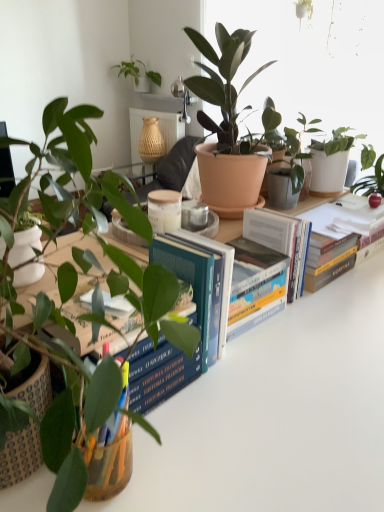
Question: Are white glossy table at center and blue hardcover book at center located far from each other?

Choices:
 (A) no
 (B) yes

Answer: (A)

Question: Is white glossy table at center behind blue hardcover book at center?

Choices:
 (A) no
 (B) yes

Answer: (A)

Question: Is the depth of white glossy table at center less than that of blue hardcover book at center?

Choices:
 (A) no
 (B) yes

Answer: (B)

Question: Could you tell me if white glossy table at center is facing blue hardcover book at center?

Choices:
 (A) no
 (B) yes

Answer: (A)

Question: Considering the relative sizes of white glossy table at center and blue hardcover book at center in the image provided, is white glossy table at center bigger than blue hardcover book at center?

Choices:
 (A) no
 (B) yes

Answer: (B)

Question: From the image's perspective, is white glossy table at center on blue hardcover book at center?

Choices:
 (A) no
 (B) yes

Answer: (A)

Question: Is blue hardcover book at center shorter than white glossy table at center?

Choices:
 (A) no
 (B) yes

Answer: (B)

Question: Can you confirm if blue hardcover book at center is positioned to the right of white glossy table at center?

Choices:
 (A) no
 (B) yes

Answer: (A)

Question: Would you say blue hardcover book at center is outside white glossy table at center?

Choices:
 (A) no
 (B) yes

Answer: (B)

Question: Would you say white glossy table at center is part of blue hardcover book at center's contents?

Choices:
 (A) yes
 (B) no

Answer: (B)

Question: Does blue hardcover book at center have a larger size compared to white glossy table at center?

Choices:
 (A) no
 (B) yes

Answer: (A)

Question: Would you consider blue hardcover book at center to be distant from white glossy table at center?

Choices:
 (A) no
 (B) yes

Answer: (A)

Question: In terms of width, does blue hardcover book at center look wider or thinner when compared to white glossy table at center?

Choices:
 (A) thin
 (B) wide

Answer: (A)